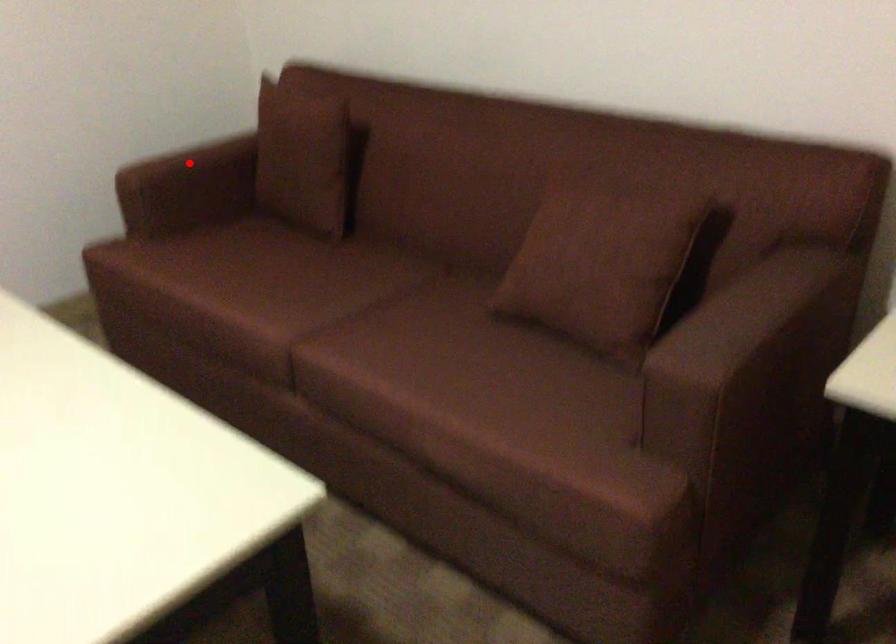
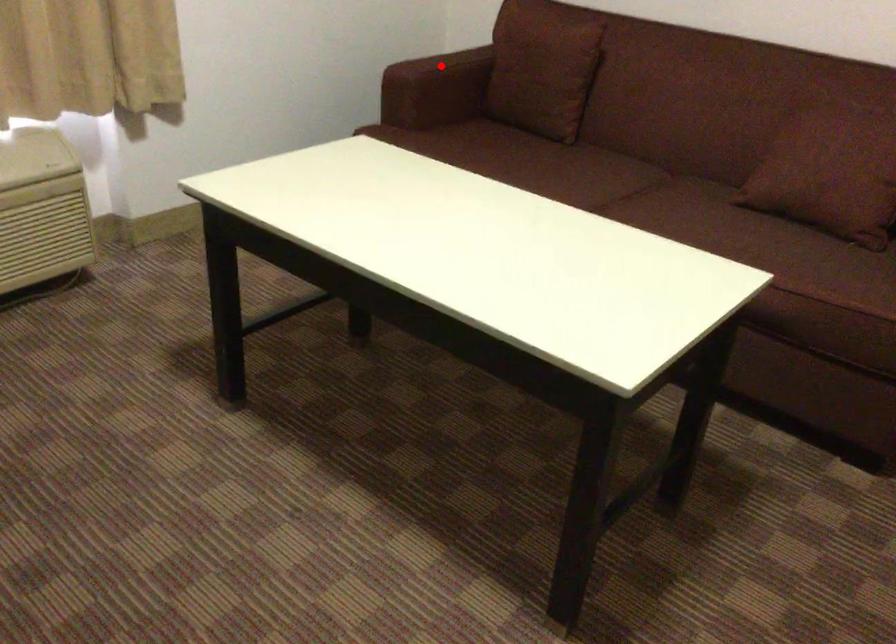
I am providing you with two images of the same scene from different viewpoints. A red point is marked on the first image and another point is marked on the second image. Is the marked point in image1 the same physical position as the marked point in image2?

Yes